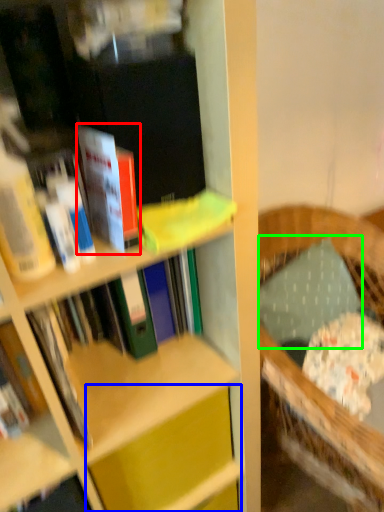
Question: Which object is the closest to the book (highlighted by a red box)? Choose among these: cabinet (highlighted by a blue box) or pillow (highlighted by a green box).

Choices:
 (A) cabinet
 (B) pillow

Answer: (A)